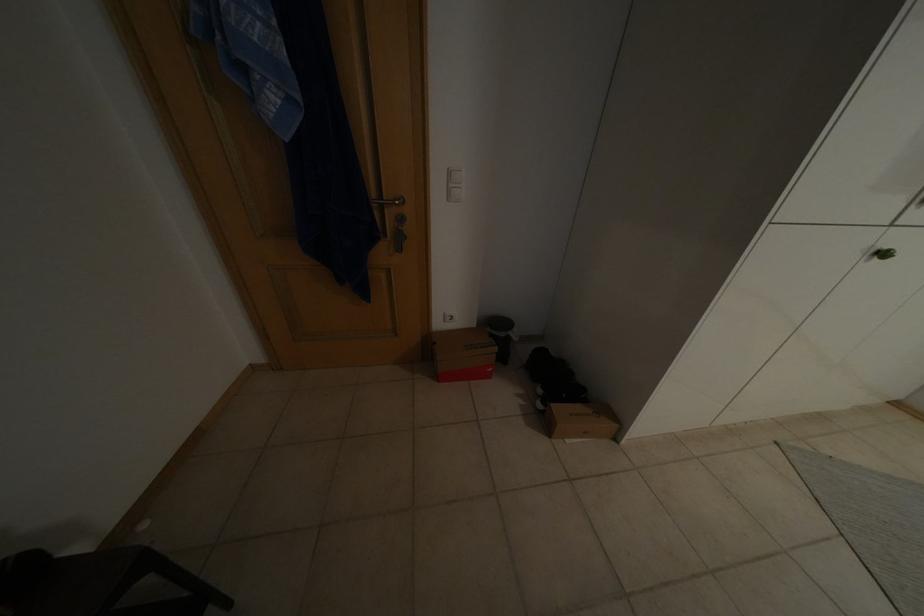
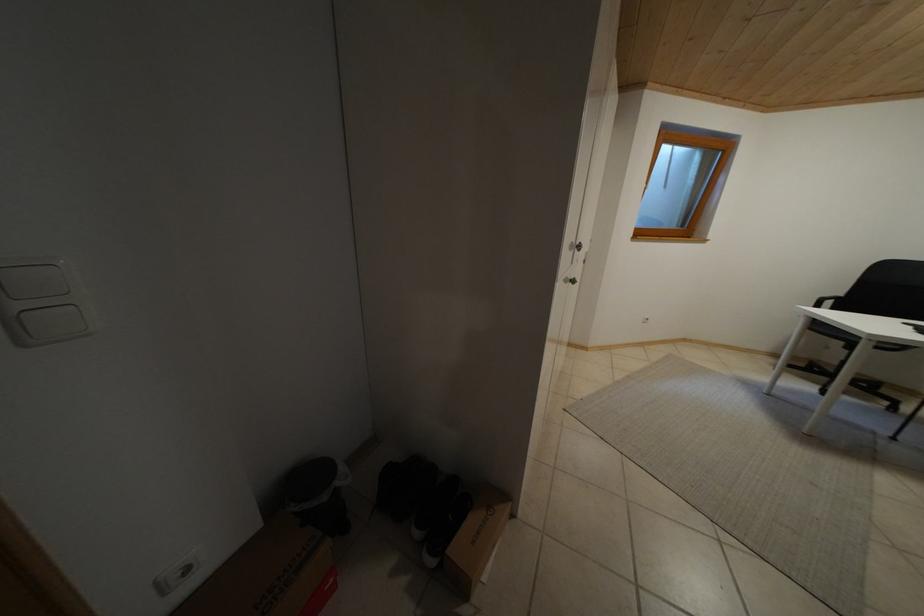
Question: Based on the continuous images, in which direction is the camera rotating? Reply with the corresponding letter.

Choices:
 (A) Left
 (B) Right
 (C) Up
 (D) Down

Answer: (B)